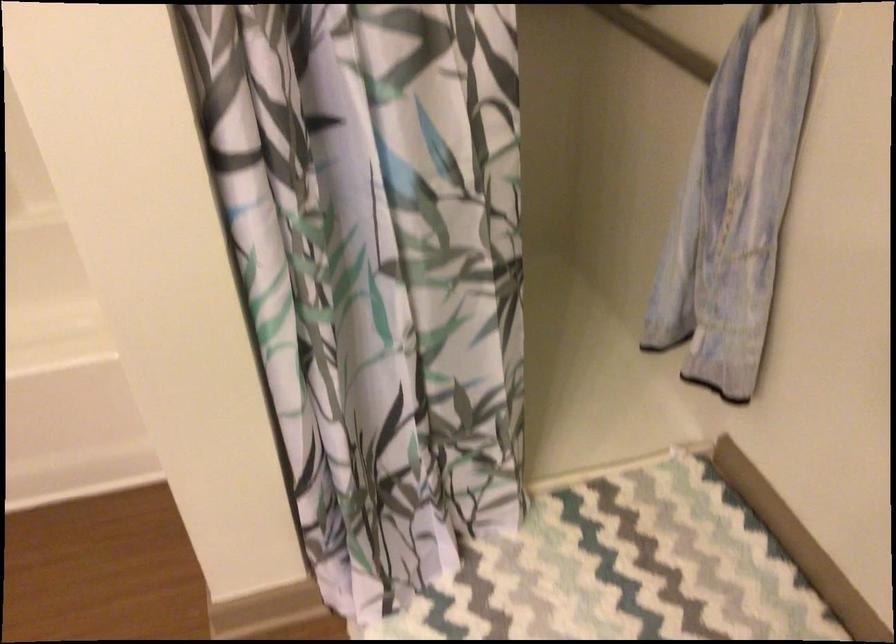
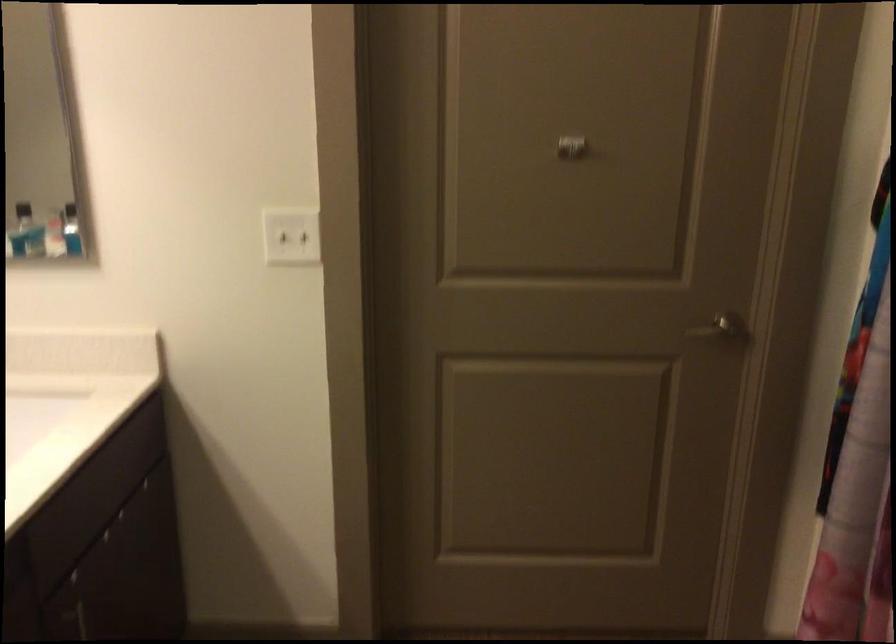
First-person continuous shooting, in which direction is the camera rotating?

The rotation direction of the camera is left-down.